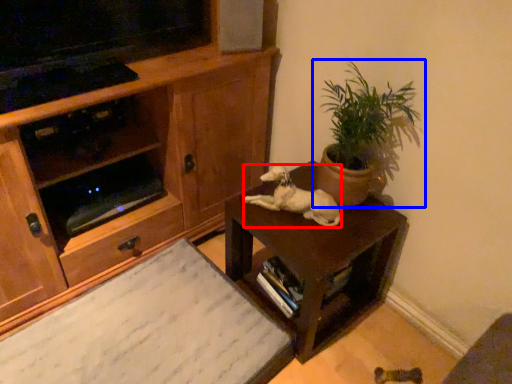
Question: Which of the following is the closest to the observer, animal (highlighted by a red box) or houseplant (highlighted by a blue box)?

Choices:
 (A) animal
 (B) houseplant

Answer: (B)